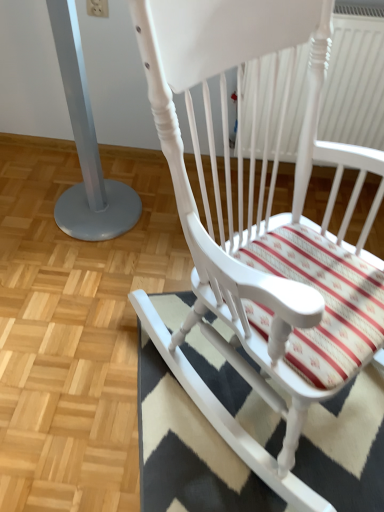
Locate an element on the screen. The width and height of the screenshot is (384, 512). vacant area situated to the left side of silver metallic pole at left is located at coordinates (31, 201).